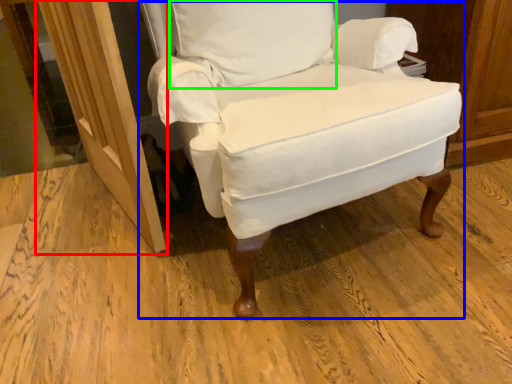
Question: Which object is positioned farthest from screen door (highlighted by a red box)? Select from chair (highlighted by a blue box) and pillow (highlighted by a green box).

Choices:
 (A) chair
 (B) pillow

Answer: (B)